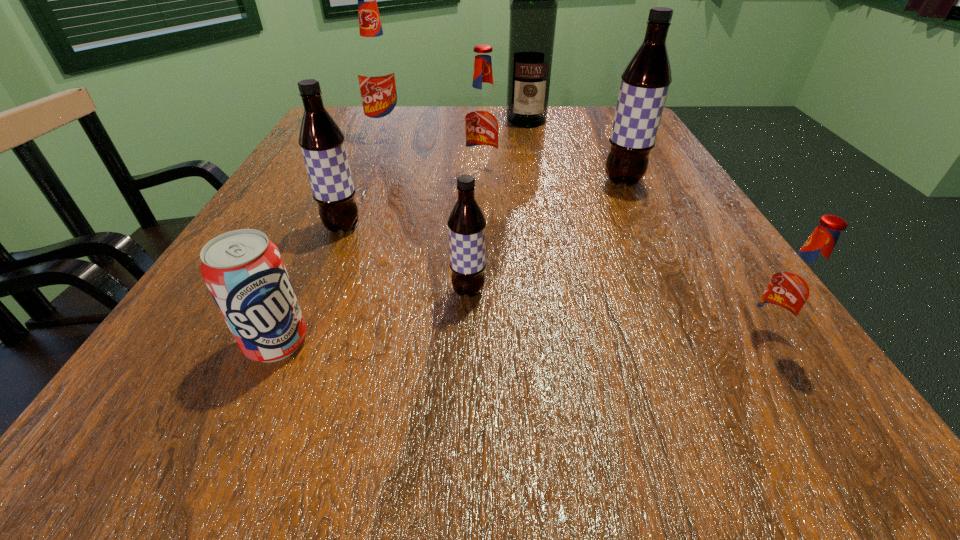
Where is `the third object from right to left`? This screenshot has width=960, height=540. the third object from right to left is located at coordinates (533, 10).

Find the location of a particular element. The image size is (960, 540). the tallest object is located at coordinates (533, 10).

Identify the location of the leftmost red root beer. (376, 70).

I want to click on the farthest root beer, so click(376, 70).

This screenshot has width=960, height=540. I want to click on the farthest brown root beer, so click(645, 82).

Where is `the seventh object from left to right`? The width and height of the screenshot is (960, 540). the seventh object from left to right is located at coordinates (645, 82).

Locate an element on the screen. This screenshot has width=960, height=540. the second smallest red root beer is located at coordinates (482, 119).

Find the location of a particular element. the second nearest red root beer is located at coordinates (482, 119).

This screenshot has height=540, width=960. I want to click on the fifth farthest object, so click(x=322, y=143).

Image resolution: width=960 pixels, height=540 pixels. In order to click on the second biggest brown root beer in this screenshot , I will do `click(322, 143)`.